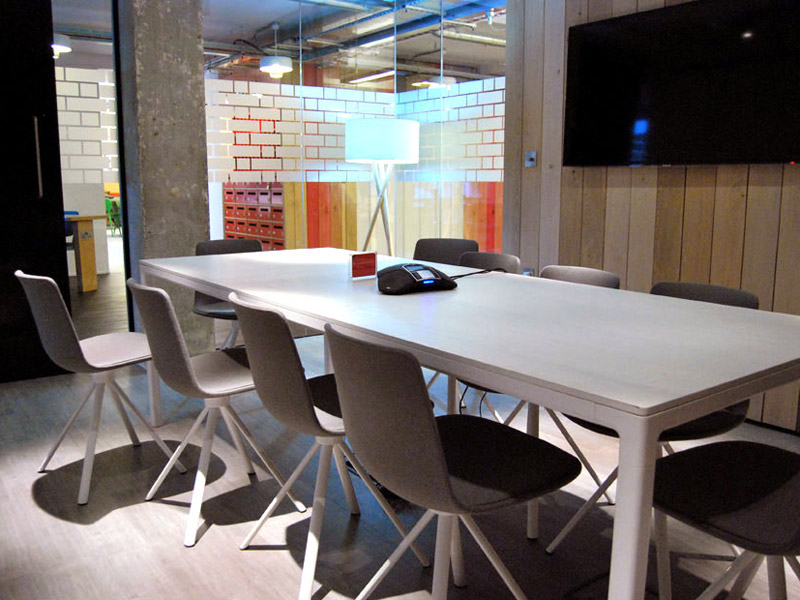
What are the coordinates of `transparent glass wall` in the screenshot? It's located at (438, 54).